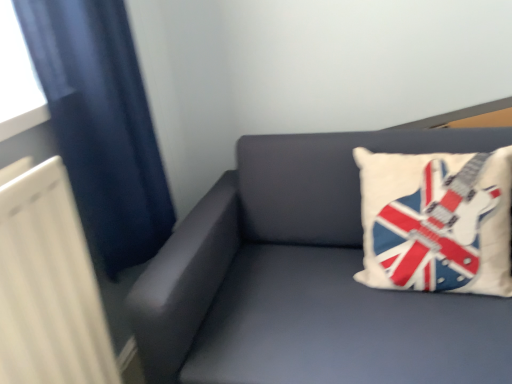
Question: Can you confirm if white fabric pillow with guitar design at upper right is bigger than dark blue fabric at left?

Choices:
 (A) yes
 (B) no

Answer: (B)

Question: Is white fabric pillow with guitar design at upper right further to camera compared to dark blue fabric at left?

Choices:
 (A) no
 (B) yes

Answer: (B)

Question: From a real-world perspective, is white fabric pillow with guitar design at upper right on dark blue fabric at left?

Choices:
 (A) yes
 (B) no

Answer: (B)

Question: Does white fabric pillow with guitar design at upper right have a greater width compared to dark blue fabric at left?

Choices:
 (A) yes
 (B) no

Answer: (A)

Question: From the image's perspective, does white fabric pillow with guitar design at upper right appear higher than dark blue fabric at left?

Choices:
 (A) yes
 (B) no

Answer: (B)

Question: Does white fabric pillow with guitar design at upper right turn towards dark blue fabric at left?

Choices:
 (A) yes
 (B) no

Answer: (B)

Question: Is dark blue fabric at left closer to the viewer compared to matte gray couch at upper right?

Choices:
 (A) yes
 (B) no

Answer: (B)

Question: From a real-world perspective, is dark blue fabric at left over matte gray couch at upper right?

Choices:
 (A) yes
 (B) no

Answer: (A)

Question: From the image's perspective, is dark blue fabric at left beneath matte gray couch at upper right?

Choices:
 (A) yes
 (B) no

Answer: (B)

Question: Can you confirm if dark blue fabric at left is wider than matte gray couch at upper right?

Choices:
 (A) yes
 (B) no

Answer: (B)

Question: Is dark blue fabric at left to the right of matte gray couch at upper right from the viewer's perspective?

Choices:
 (A) no
 (B) yes

Answer: (A)

Question: Is the position of dark blue fabric at left more distant than that of matte gray couch at upper right?

Choices:
 (A) yes
 (B) no

Answer: (A)

Question: Does white fabric pillow with guitar design at upper right have a smaller size compared to matte gray couch at upper right?

Choices:
 (A) no
 (B) yes

Answer: (B)